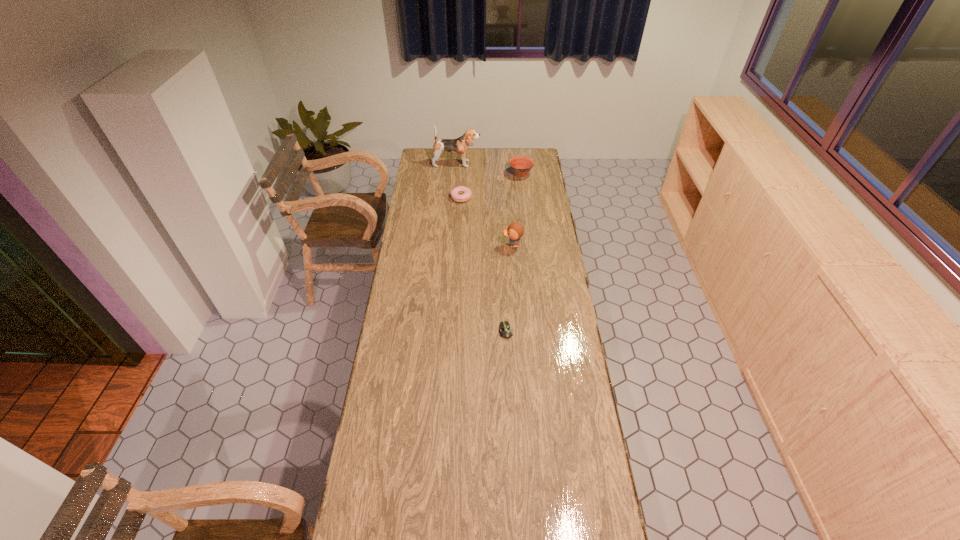
Identify the location of free space between the fourth shortest object and the shortest object. (509, 288).

Where is `free area in between the third nearest object and the tallest object`? The image size is (960, 540). free area in between the third nearest object and the tallest object is located at coordinates (459, 180).

Image resolution: width=960 pixels, height=540 pixels. What are the coordinates of `free spot between the third nearest object and the third tallest object` in the screenshot? It's located at (491, 186).

I want to click on vacant region between the duck and the doughnut, so click(487, 221).

This screenshot has width=960, height=540. In order to click on object that is the closest one to the nearest object in this screenshot , I will do `click(515, 231)`.

The image size is (960, 540). I want to click on object that stands as the closest to the doughnut, so click(x=521, y=165).

The width and height of the screenshot is (960, 540). What are the coordinates of `free region that satisfies the following two spatial constraints: 1. on the front side of the third tallest object; 2. on the front-facing side of the fourth farthest object` in the screenshot? It's located at (529, 245).

Image resolution: width=960 pixels, height=540 pixels. Find the location of `free point that satisfies the following two spatial constraints: 1. at the face of the third shortest object; 2. on the right side of the puppy`. free point that satisfies the following two spatial constraints: 1. at the face of the third shortest object; 2. on the right side of the puppy is located at coordinates (456, 174).

The height and width of the screenshot is (540, 960). What are the coordinates of `free spot that satisfies the following two spatial constraints: 1. on the front side of the doughnut; 2. on the left side of the nearest object` in the screenshot? It's located at (454, 331).

At what (x,y) coordinates should I click in order to perform the action: click on free location that satisfies the following two spatial constraints: 1. at the face of the puppy; 2. on the right side of the second shortest object. Please return your answer as a coordinate pair (x, y). Looking at the image, I should click on (454, 197).